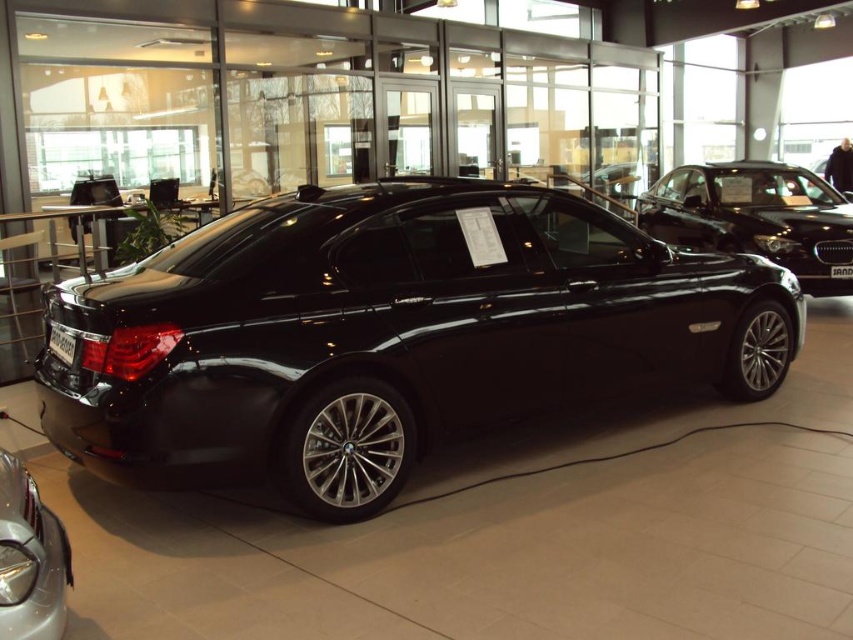
Question: Which object is positioned farthest from the glossy black sedan at upper right?

Choices:
 (A) metallic silver car at lower left
 (B) black metallic car at center

Answer: (A)

Question: Observing the image, what is the correct spatial positioning of black metallic car at center in reference to glossy black sedan at upper right?

Choices:
 (A) above
 (B) below

Answer: (B)

Question: Estimate the real-world distances between objects in this image. Which object is farther from the black metallic car at center?

Choices:
 (A) metallic silver car at lower left
 (B) glossy black sedan at upper right

Answer: (B)

Question: Can you confirm if glossy black sedan at upper right is positioned to the left of metallic silver car at lower left?

Choices:
 (A) yes
 (B) no

Answer: (B)

Question: Which object is farther from the camera taking this photo?

Choices:
 (A) metallic silver car at lower left
 (B) black metallic car at center

Answer: (B)

Question: Is black metallic car at center closer to camera compared to metallic silver car at lower left?

Choices:
 (A) yes
 (B) no

Answer: (B)